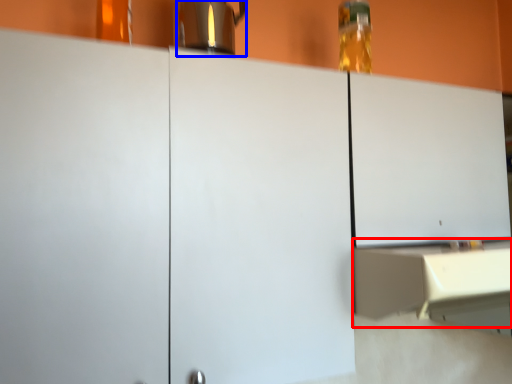
Question: Which object appears farthest to the camera in this image, counter (highlighted by a red box) or coffeepot (highlighted by a blue box)?

Choices:
 (A) counter
 (B) coffeepot

Answer: (B)